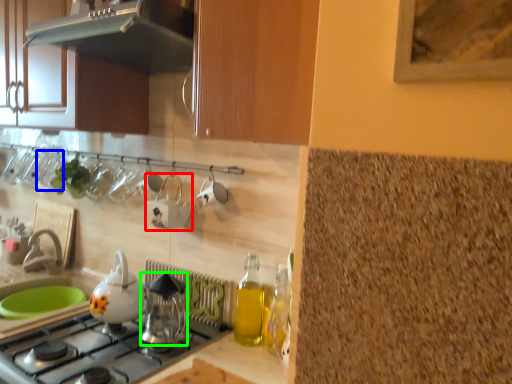
Question: Estimate the real-world distances between objects in this image. Which object is closer to appliance (highlighted by a red box), tableware (highlighted by a blue box) or kitchen appliance (highlighted by a green box)?

Choices:
 (A) tableware
 (B) kitchen appliance

Answer: (B)